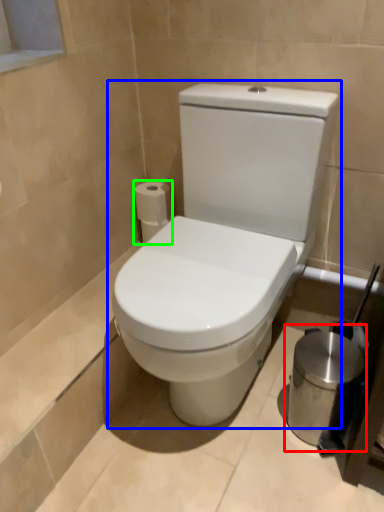
Question: Estimate the real-world distances between objects in this image. Which object is farther from appliance (highlighted by a red box), toilet (highlighted by a blue box) or toilet paper (highlighted by a green box)?

Choices:
 (A) toilet
 (B) toilet paper

Answer: (B)